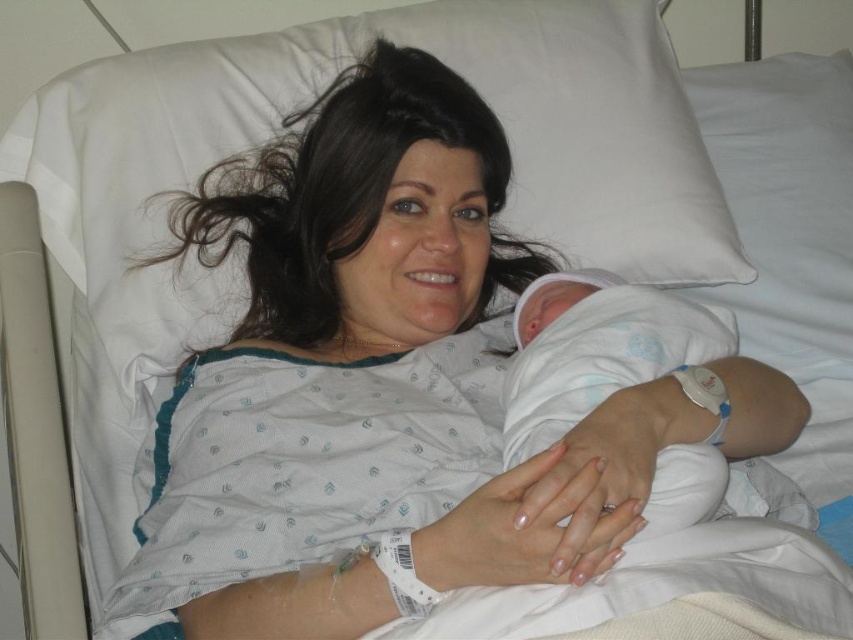
Question: Is white fabric pillow at upper right to the right of white soft cloth at center from the viewer's perspective?

Choices:
 (A) no
 (B) yes

Answer: (B)

Question: Is white fabric pillow at upper right in front of white soft cloth at center?

Choices:
 (A) no
 (B) yes

Answer: (A)

Question: Which object is farther from the camera taking this photo?

Choices:
 (A) white fabric pillow at upper right
 (B) white soft cloth at center

Answer: (A)

Question: Does white fabric pillow at upper right have a greater width compared to white soft cloth at center?

Choices:
 (A) yes
 (B) no

Answer: (A)

Question: Which object appears farthest from the camera in this image?

Choices:
 (A) white soft cloth at center
 (B) white fabric pillow at upper right

Answer: (B)